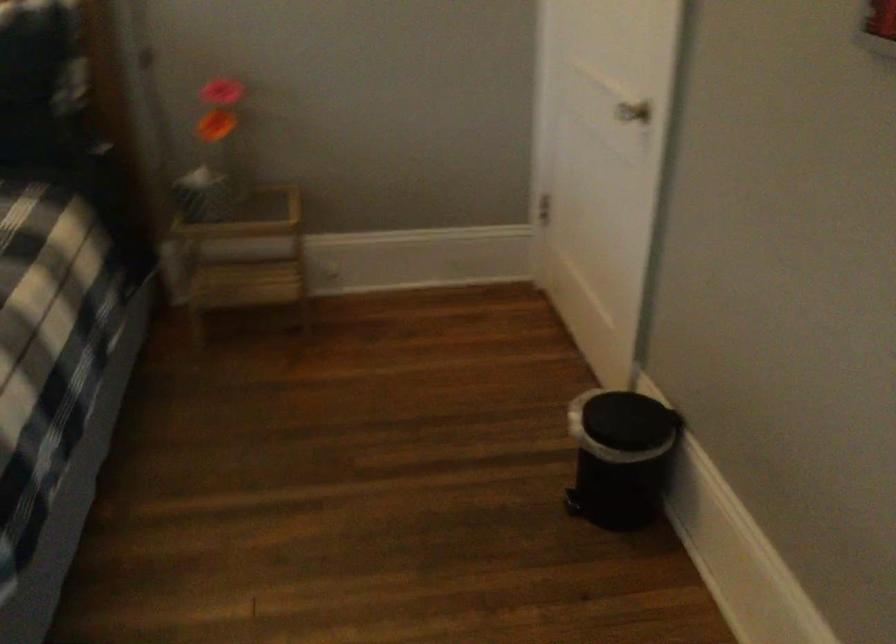
The width and height of the screenshot is (896, 644). In order to click on door handle in this screenshot , I will do `click(633, 111)`.